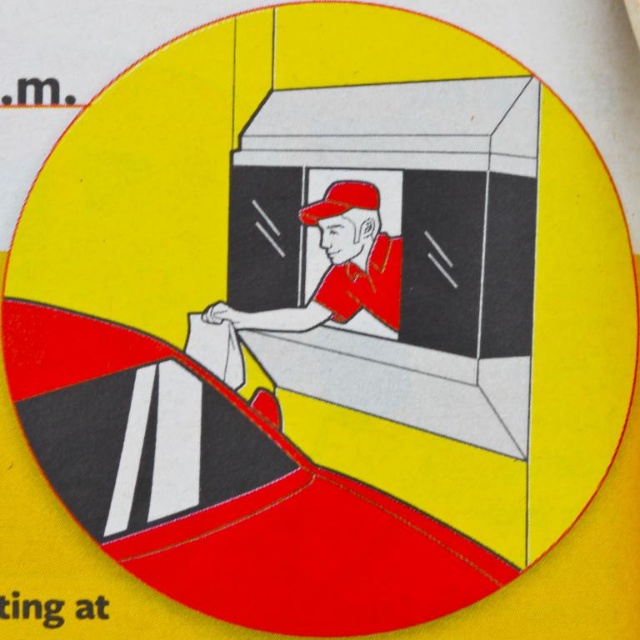
Question: Does matte red uniform at center have a greater width compared to red matte baseball cap at center?

Choices:
 (A) yes
 (B) no

Answer: (A)

Question: Which point is closer to the camera taking this photo?

Choices:
 (A) (333, 250)
 (B) (372, 198)

Answer: (B)

Question: Which of the following is the closest to the observer?

Choices:
 (A) matte red uniform at center
 (B) red matte baseball cap at center

Answer: (A)

Question: Observing the image, what is the correct spatial positioning of matte red uniform at center in reference to red matte baseball cap at center?

Choices:
 (A) above
 (B) below

Answer: (B)

Question: Does matte red uniform at center have a smaller size compared to red matte baseball cap at center?

Choices:
 (A) no
 (B) yes

Answer: (A)